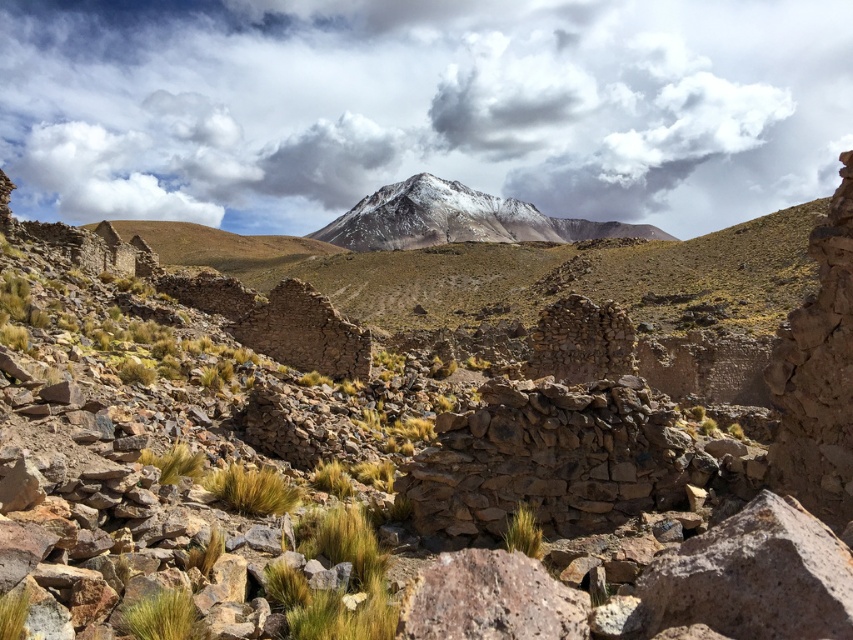
Question: From the image, what is the correct spatial relationship of snowy rocky mountain at center in relation to golden grass at center?

Choices:
 (A) above
 (B) below

Answer: (A)

Question: Which point is farther from the camera taking this photo?

Choices:
 (A) (289, 502)
 (B) (526, 592)

Answer: (A)

Question: Can you confirm if golden grass at center is wider than green grass at center?

Choices:
 (A) yes
 (B) no

Answer: (B)

Question: Does green grass at lower left appear on the right side of green grass at center?

Choices:
 (A) no
 (B) yes

Answer: (A)

Question: Estimate the real-world distances between objects in this image. Which object is closer to the green grass at center?

Choices:
 (A) green grass at lower left
 (B) brown stone ruins at center

Answer: (A)

Question: Considering the real-world distances, which object is closest to the brown stone ruins at center?

Choices:
 (A) golden grass at center
 (B) green grass at lower left
 (C) snowy rocky mountain at center
 (D) green grass at center

Answer: (B)